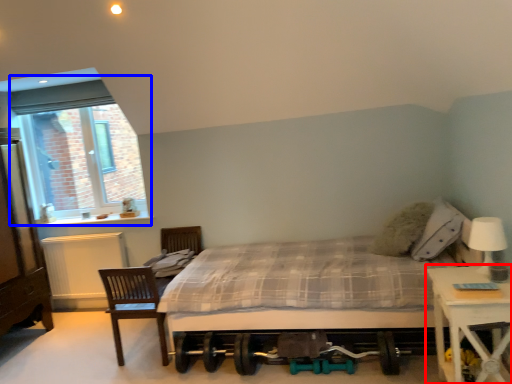
Question: Which point is further to the camera, nightstand (highlighted by a red box) or window (highlighted by a blue box)?

Choices:
 (A) nightstand
 (B) window

Answer: (B)